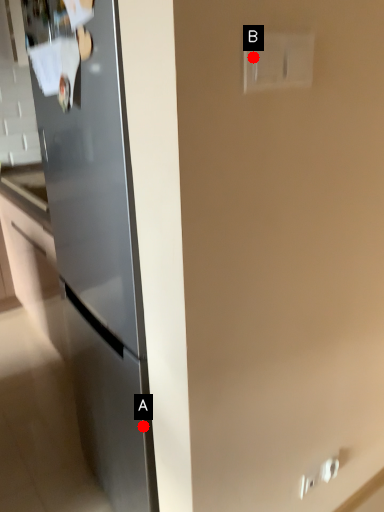
Question: Two points are circled on the image, labeled by A and B beside each circle. Which of the following is the farthest from the observer?

Choices:
 (A) A is further
 (B) B is further

Answer: (A)